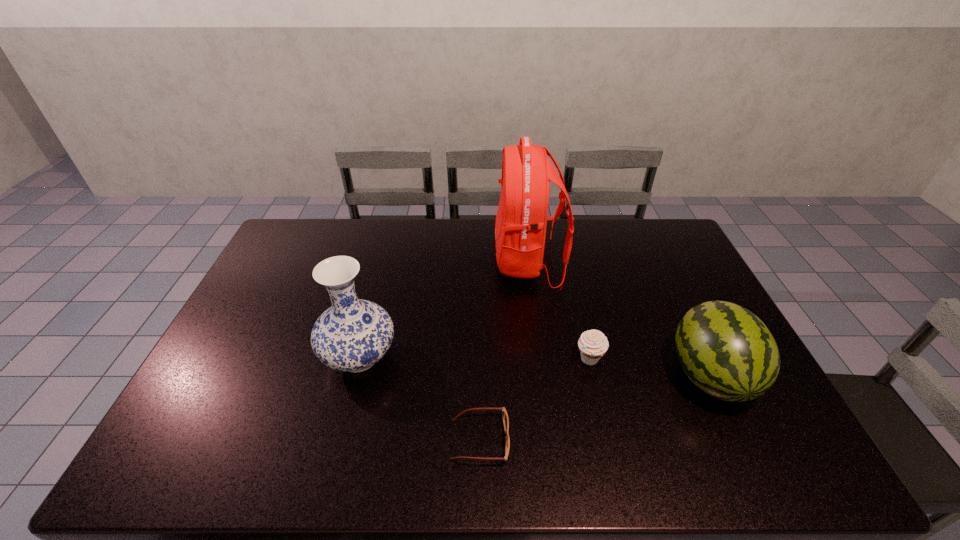
Locate an element on the screen. This screenshot has width=960, height=540. vacant region at the left edge is located at coordinates (290, 294).

Where is `free point at the right edge`? free point at the right edge is located at coordinates (715, 412).

In order to click on vacant space at the far left corner of the desktop in this screenshot , I will do `click(306, 242)`.

The width and height of the screenshot is (960, 540). What are the coordinates of `vacant space that is in between the watermelon and the spectacles` in the screenshot? It's located at (595, 408).

Identify the location of vacant area between the third shortest object and the spectacles. The image size is (960, 540). coord(595,408).

I want to click on vacant space in between the leftmost object and the spectacles, so click(x=420, y=399).

Locate an element on the screen. Image resolution: width=960 pixels, height=540 pixels. blank region between the farthest object and the rightmost object is located at coordinates (619, 319).

The width and height of the screenshot is (960, 540). I want to click on vacant space that is in between the farthest object and the vase, so click(x=444, y=310).

Locate an element on the screen. vacant area that lies between the rightmost object and the tallest object is located at coordinates (619, 319).

Find the location of `empty space that is in between the shortest object and the second shortest object`. empty space that is in between the shortest object and the second shortest object is located at coordinates (535, 400).